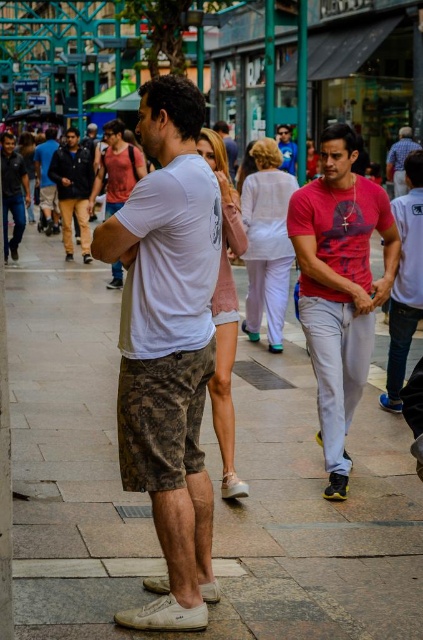
In the scene shown: You are standing at the point with coordinates point (x=285, y=154) and want to walk to the point with coordinates point (x=400, y=141). Is the destination point located behind you or in front of you?

The destination point with coordinates point (x=400, y=141) is behind the starting point with coordinates point (x=285, y=154), so it is located behind you.

You are a delivery robot that needs to move from the gray stone pavement at center to the blue denim jeans at center. Can you navigate the height difference between them?

The gray stone pavement at center has a greater height compared to the blue denim jeans at center, so the delivery robot can navigate the height difference as it can descend from the higher pavement to the lower jeans.